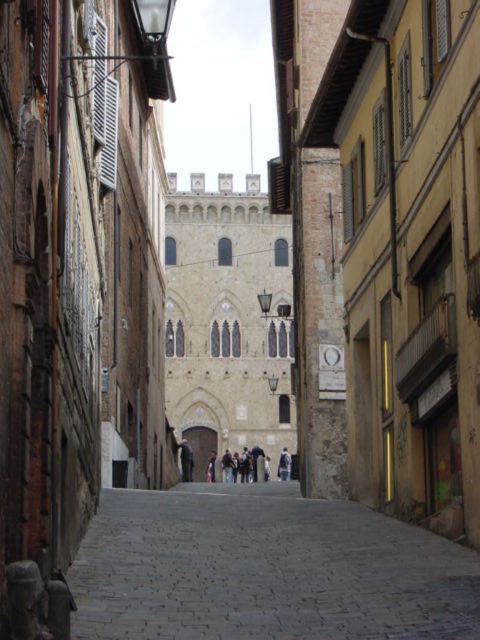
Which is below, gray cobblestone path at center or light brown leather jacket at center?

light brown leather jacket at center

Does gray cobblestone path at center have a larger size compared to light brown leather jacket at center?

Yes.

Measure the distance between point (129, 589) and camera.

Point (129, 589) is 170.72 feet away from camera.

Image resolution: width=480 pixels, height=640 pixels. Find the location of `gray cobblestone path at center`. gray cobblestone path at center is located at coordinates (265, 570).

Does gray cobblestone path at center appear over dark brown leather jacket at center?

Correct, gray cobblestone path at center is located above dark brown leather jacket at center.

Can you confirm if gray cobblestone path at center is shorter than dark brown leather jacket at center?

Correct, gray cobblestone path at center is not as tall as dark brown leather jacket at center.

What do you see at coordinates (265, 570) in the screenshot? I see `gray cobblestone path at center` at bounding box center [265, 570].

Where is `gray cobblestone path at center`? The height and width of the screenshot is (640, 480). gray cobblestone path at center is located at coordinates (265, 570).

In the scene shown: Who is taller, dark brown leather jacket at center or light brown leather jacket at center?

Standing taller between the two is dark brown leather jacket at center.

Looking at this image, which is below, dark brown leather jacket at center or light brown leather jacket at center?

light brown leather jacket at center is below.

This screenshot has width=480, height=640. Describe the element at coordinates (186, 460) in the screenshot. I see `dark brown leather jacket at center` at that location.

Locate an element on the screen. The width and height of the screenshot is (480, 640). dark brown leather jacket at center is located at coordinates (186, 460).